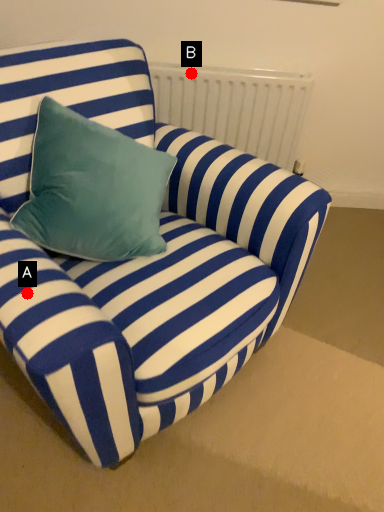
Question: Two points are circled on the image, labeled by A and B beside each circle. Which point is farther to the camera?

Choices:
 (A) A is further
 (B) B is further

Answer: (B)